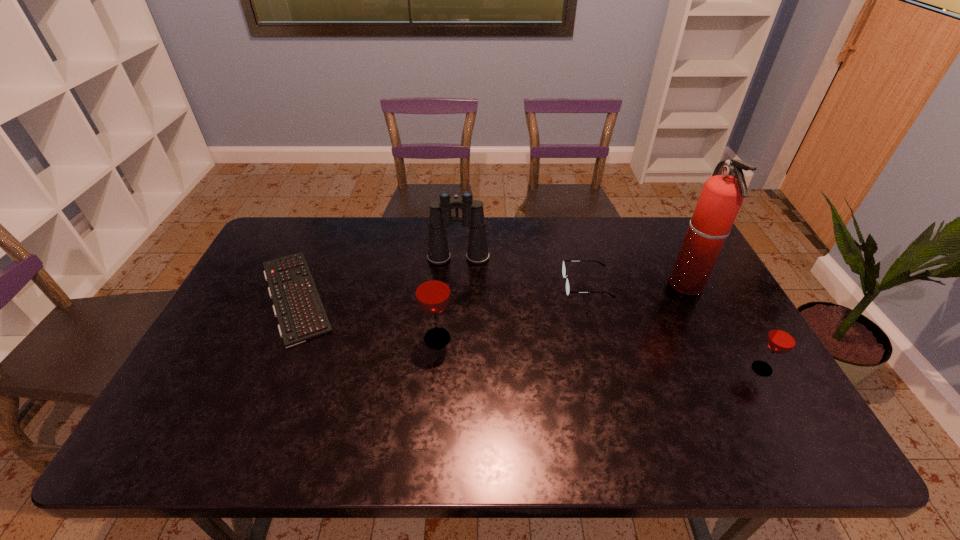
The width and height of the screenshot is (960, 540). In order to click on vacant spot for a new glass_(drink_container) to ensure equal spacing in this screenshot , I will do `click(594, 353)`.